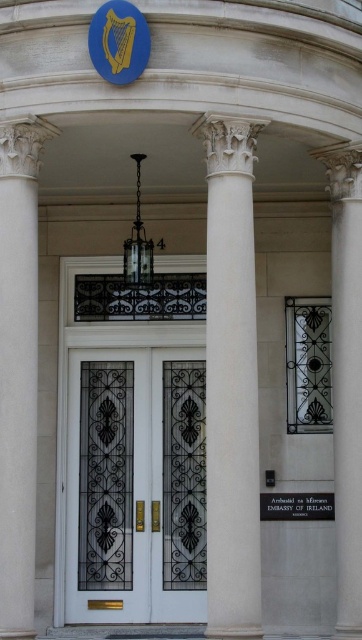
You are standing at the entrance of the Embassy of Ireland and want to locate the gold door knocker. Based on the white marble column at center and the white marble column at right, which column is positioned higher relative to the other?

The white marble column at center is located above the white marble column at right, so the white marble column at center is positioned higher than the white marble column at right.

You are standing in front of the Embassy of Ireland entrance. You notice two points marked on the image. The first point is at coordinates point (73, 390) and the second is at point (9, 248). Which point is closer to you?

Point (9, 248) is closer to you because point (73, 390) is further to the camera than point (9, 248).